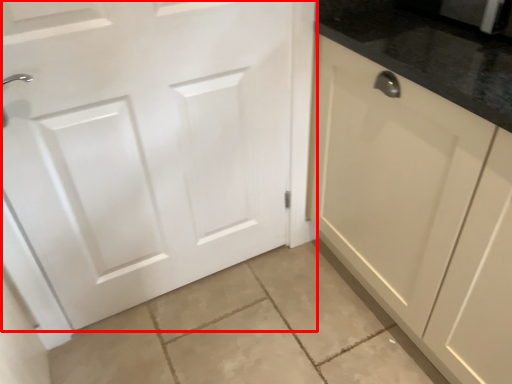
Question: From the image's perspective, considering the relative positions of door (annotated by the red box) and cabinetry in the image provided, where is door (annotated by the red box) located with respect to the staircase?

Choices:
 (A) below
 (B) above

Answer: (B)